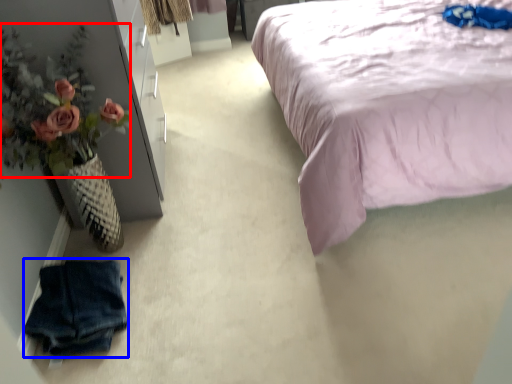
Question: Among these objects, which one is farthest to the camera, floral arrangement (highlighted by a red box) or clothing (highlighted by a blue box)?

Choices:
 (A) floral arrangement
 (B) clothing

Answer: (A)